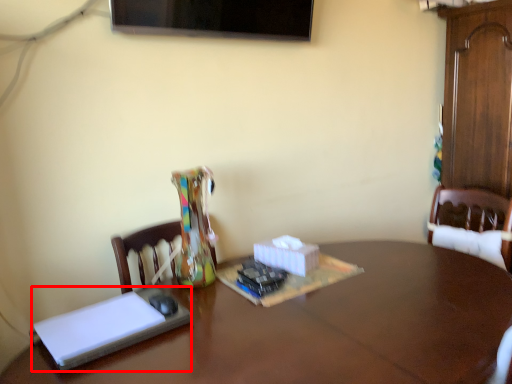
Question: Where is book (annotated by the red box) located in relation to table in the image?

Choices:
 (A) right
 (B) left

Answer: (B)